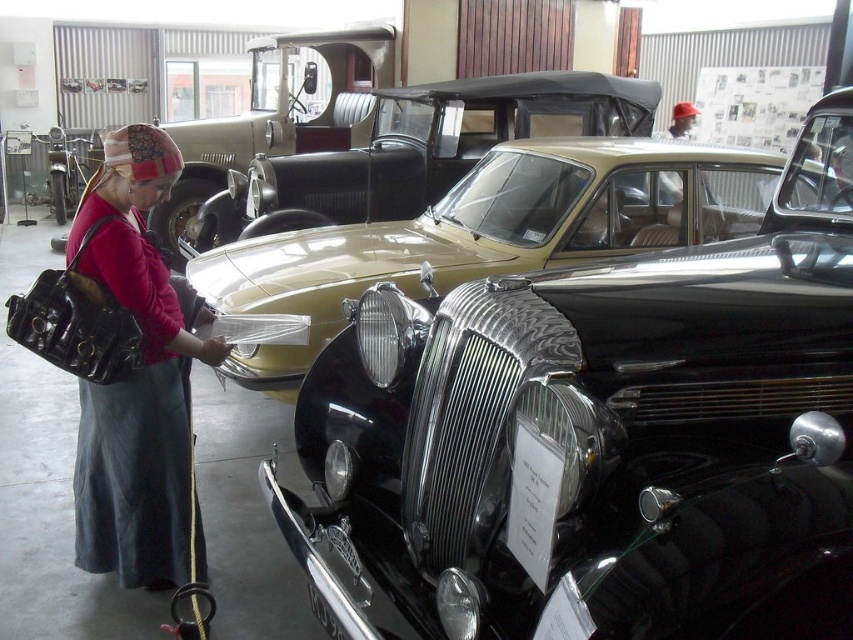
You are a security guard in the museum and need to place a matte black purse at left on a shelf near the black polished metal car at center. The shelf can only hold items smaller than the car. Can the purse be placed there?

The black polished metal car at center has a larger size compared to matte black purse at left, so yes, the matte black purse at left can be placed on the shelf since it is smaller than the car.

You are a visitor at the vintage car museum and notice a matte black purse at left and a beige fabric convertible at center. Which object is nearer to you as you stand in front of the display?

The matte black purse at left is closer to the viewer than the beige fabric convertible at center, so the purse is nearer to you.

You are a tour guide explaining the layout of the car museum to a visitor. You mention the metallic gold car at center and the matte black purse at left. Which object takes up more horizontal space in the image?

The metallic gold car at center takes up more horizontal space than the matte black purse at left because its width surpasses that of the purse.